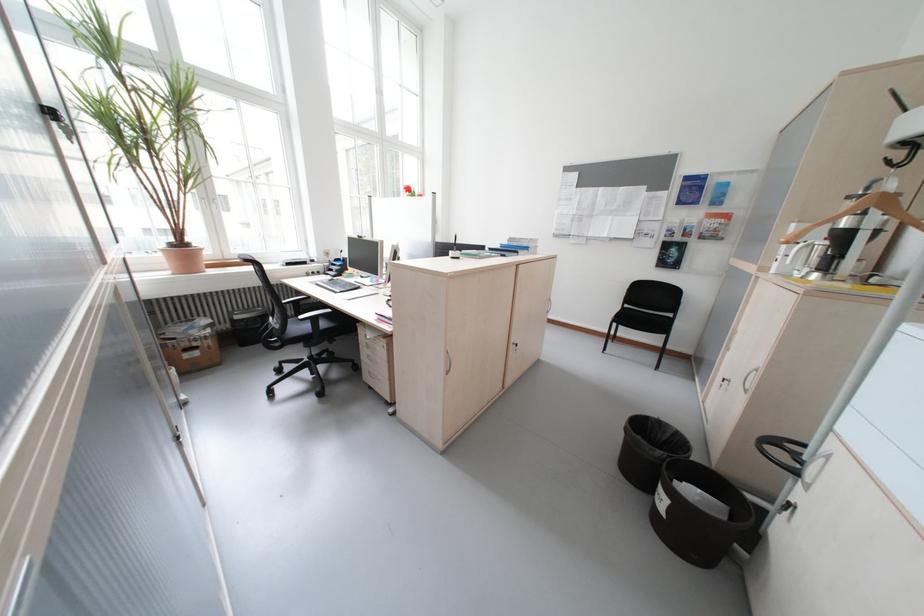
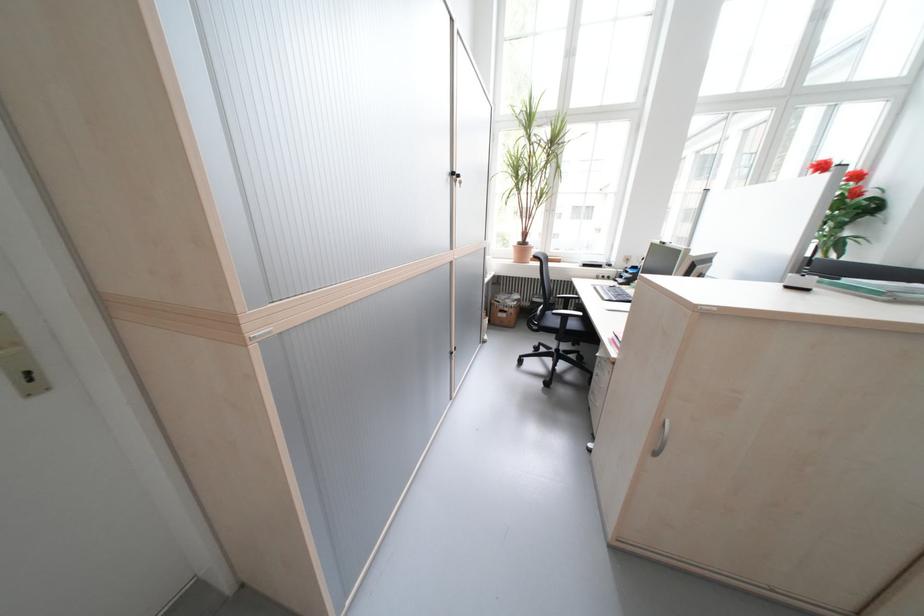
In the second image, find the point that corresponds to pixel 207 355 in the first image.

(515, 315)